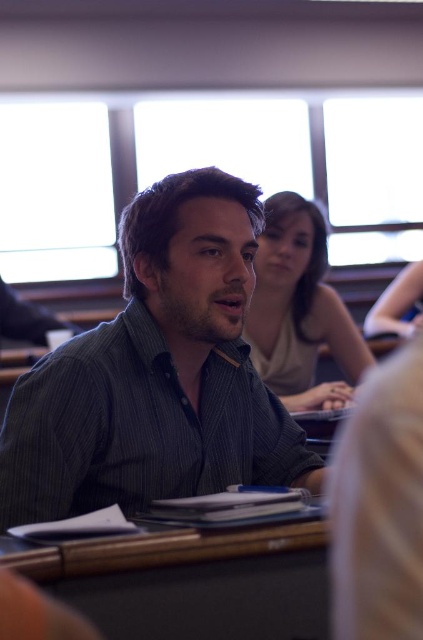
You are standing in the classroom and want to locate the dark green striped shirt at center. What are the coordinates of its position?

The dark green striped shirt at center is located at coordinates point (156,372).

You are a student in the classroom and need to place your backpack on the black matte table at lower center. However, you notice the matte gray shirt at center is already occupying space on it. Can the backpack fit on the table if the backpack is 30 cm in width?

The black matte table at lower center has a smaller size compared to matte gray shirt at center. Since the table is smaller and the shirt is taking up space, the backpack may not fit properly. Check for another table.

You are a student trying to sit at the black matte table at lower center. The dark green striped shirt at center is in front of the table. Can you sit there without moving the shirt?

The dark green striped shirt at center might be wider than black matte table at lower center, so there is a possibility that the shirt is wider than the table. If the shirt is wider, it might block access to the table, making it difficult to sit without moving it. However, if the shirt is narrower, then you could sit without moving it. Since the exact dimensions aren